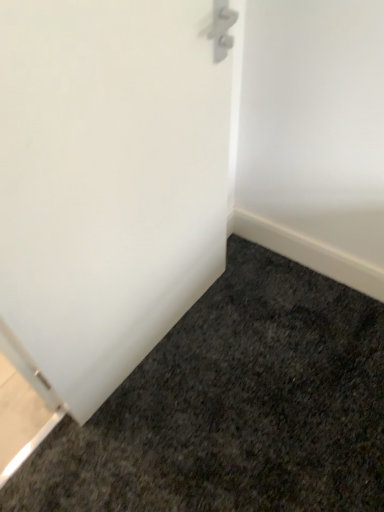
The width and height of the screenshot is (384, 512). Describe the element at coordinates (234, 407) in the screenshot. I see `dark gray granite at lower right` at that location.

In order to face dark gray granite at lower right, should I rotate leftwards or rightwards?

It's best to rotate right around 0.773 degrees.

The height and width of the screenshot is (512, 384). Find the location of `dark gray granite at lower right`. dark gray granite at lower right is located at coordinates (234, 407).

You are a GUI agent. You are given a task and a screenshot of the screen. Output one action in this format:
    pyautogui.click(x=<x>, y=<y>)
    Task: Click on the dark gray granite at lower right
    
    Given the screenshot: What is the action you would take?
    pyautogui.click(x=234, y=407)